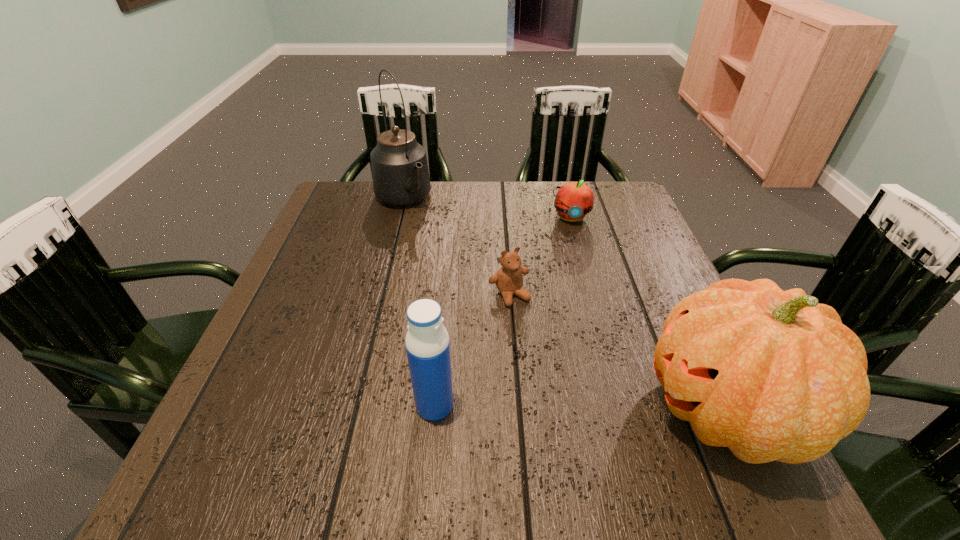
The height and width of the screenshot is (540, 960). What are the coordinates of `object that is at the near right corner` in the screenshot? It's located at (772, 375).

In the image, there is a desktop. Where is `free space at the far edge`? The height and width of the screenshot is (540, 960). free space at the far edge is located at coordinates (520, 222).

Identify the location of free spot at the near edge of the desktop. (603, 418).

This screenshot has height=540, width=960. I want to click on free space at the left edge of the desktop, so click(x=327, y=313).

Identify the location of vacant space at the right edge. The width and height of the screenshot is (960, 540). (630, 282).

Find the location of a particular element. free space at the far left corner of the desktop is located at coordinates (358, 181).

Identify the location of vacant area at the near left corner. Image resolution: width=960 pixels, height=540 pixels. (244, 423).

In the image, there is a desktop. Identify the location of vacant space at the far right corner. The image size is (960, 540). (631, 204).

Where is `vacant space that is in between the pumpkin and the third nearest object`? vacant space that is in between the pumpkin and the third nearest object is located at coordinates (617, 352).

At what (x,y) coordinates should I click in order to perform the action: click on vacant space that is in between the kettle and the third object from left to right. Please return your answer as a coordinate pair (x, y). This screenshot has width=960, height=540. Looking at the image, I should click on (456, 248).